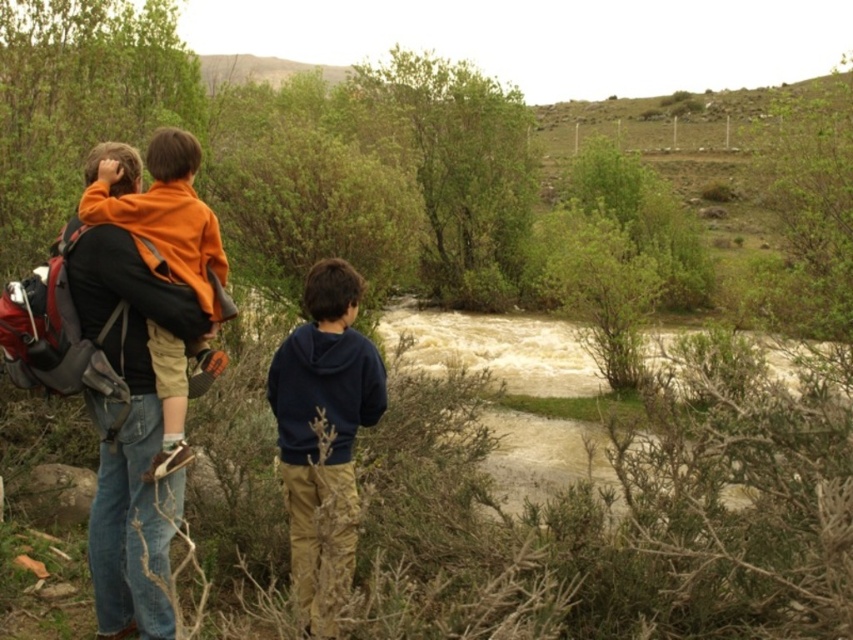
Is navy blue hoodie at center in front of orange fleece jacket at left?

Yes, navy blue hoodie at center is closer to the viewer.

Does navy blue hoodie at center have a larger size compared to orange fleece jacket at left?

Indeed, navy blue hoodie at center has a larger size compared to orange fleece jacket at left.

Between point (289, 484) and point (223, 317), which one is positioned behind?

Positioned behind is point (289, 484).

You are a GUI agent. You are given a task and a screenshot of the screen. Output one action in this format:
    pyautogui.click(x=<x>, y=<y>)
    Task: Click on the navy blue hoodie at center
    The image size is (853, 640).
    Given the screenshot: What is the action you would take?
    pyautogui.click(x=323, y=413)